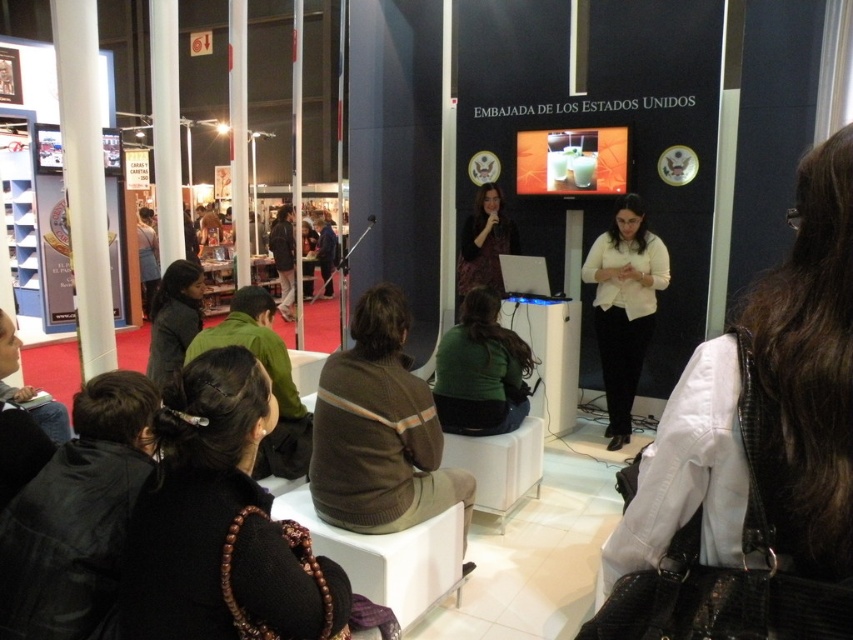
You are organizing a photo shoot in the described scene and need to place a spotlight on the white matte shirt at center. According to the coordinates provided, where should you position the spotlight?

The white matte shirt at center is located at coordinates point (753,456), so the spotlight should be positioned there to illuminate it.

You are standing in the event space and want to take a photo of both point (503,349) and point (169,276). Which point should you focus on first to ensure both are in clear view?

Point (503,349) is closer to the camera than point (169,276). To ensure both are in clear view, focus on the closer point first, which is point (503,349).